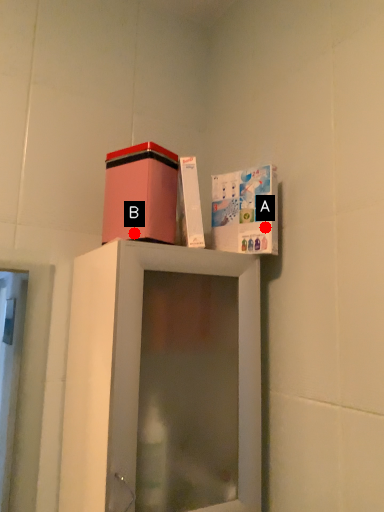
Question: Two points are circled on the image, labeled by A and B beside each circle. Which point is closer to the camera?

Choices:
 (A) A is closer
 (B) B is closer

Answer: (B)